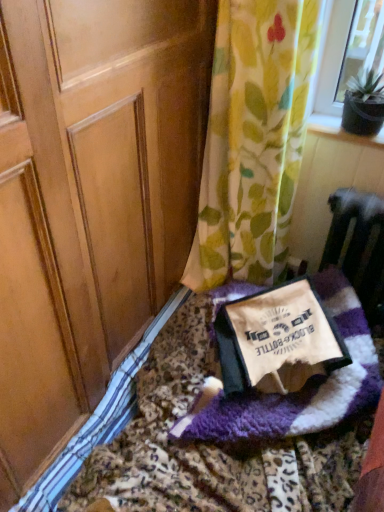
Question: From the image's perspective, is floral fabric curtain at upper right positioned above or below purple fuzzy blanket at lower right?

Choices:
 (A) above
 (B) below

Answer: (A)

Question: From a real-world perspective, is floral fabric curtain at upper right positioned above or below purple fuzzy blanket at lower right?

Choices:
 (A) below
 (B) above

Answer: (B)

Question: Estimate the real-world distances between objects in this image. Which object is closer to the floral fabric curtain at upper right?

Choices:
 (A) beige fleece blanket at center
 (B) purple fuzzy blanket at lower right

Answer: (A)

Question: Which is nearer to the beige fleece blanket at center?

Choices:
 (A) purple fuzzy blanket at lower right
 (B) floral fabric curtain at upper right

Answer: (A)